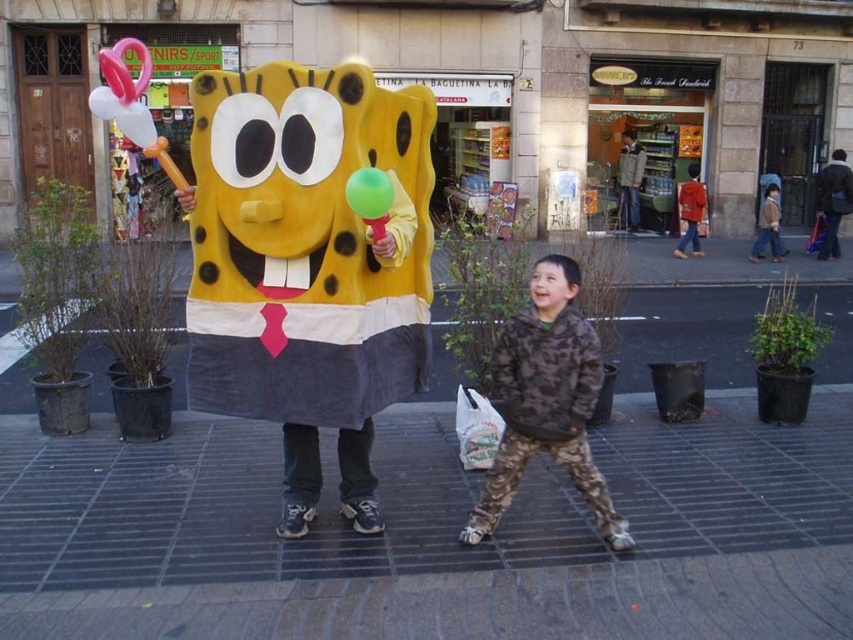
You are a photographer standing in front of the sponge and balloon. You want to take a picture of both the matte yellow sponge at center and the green rubber balloon at center. Which object should you focus on first to ensure both are in clear view?

The matte yellow sponge at center is further to the viewer than the green rubber balloon at center, so you should focus on the matte yellow sponge at center first to ensure both are in clear view.

You are a photographer trying to capture a photo of both the matte yellow sponge at center and the camouflage jacket at center. Since the sponge is much taller than the jacket, where should you position your camera to ensure both subjects are fully visible in the frame?

Position the camera at a lower angle to capture the full height of the matte yellow sponge at center while still including the camouflage jacket at center in the frame.

Consider the image. You are a street performer in a SpongeBob costume holding a matte yellow sponge at center and a green rubber balloon at center. You need to hand the balloon to a child standing nearby. Can you stretch your arm to reach the child while holding both items? The child is 1 meter away from you.

The distance between the matte yellow sponge at center and the green rubber balloon at center is 56.11 centimeters. Since the child is 1 meter away, you can stretch your arm to reach them while holding both items as the distance between the sponge and balloon is shorter than the distance to the child.